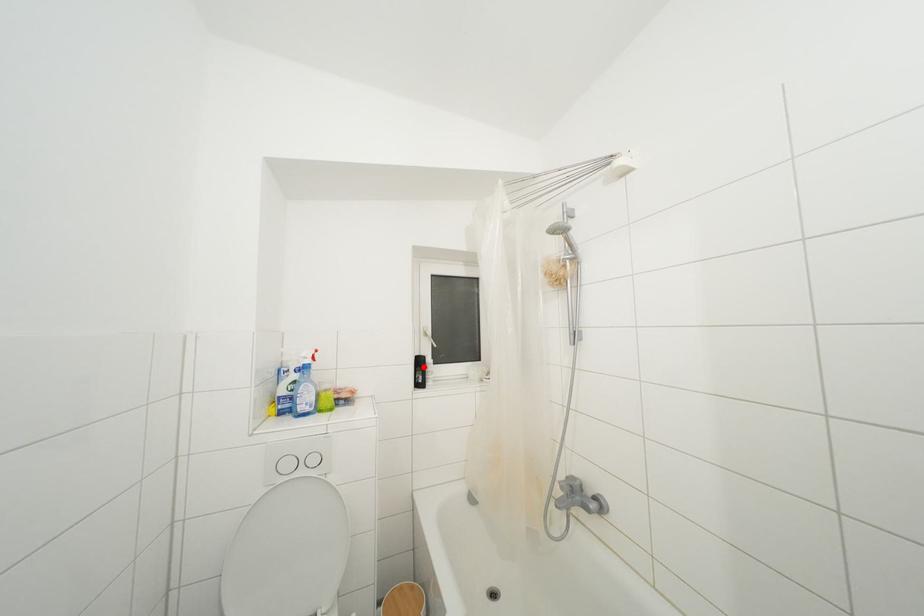
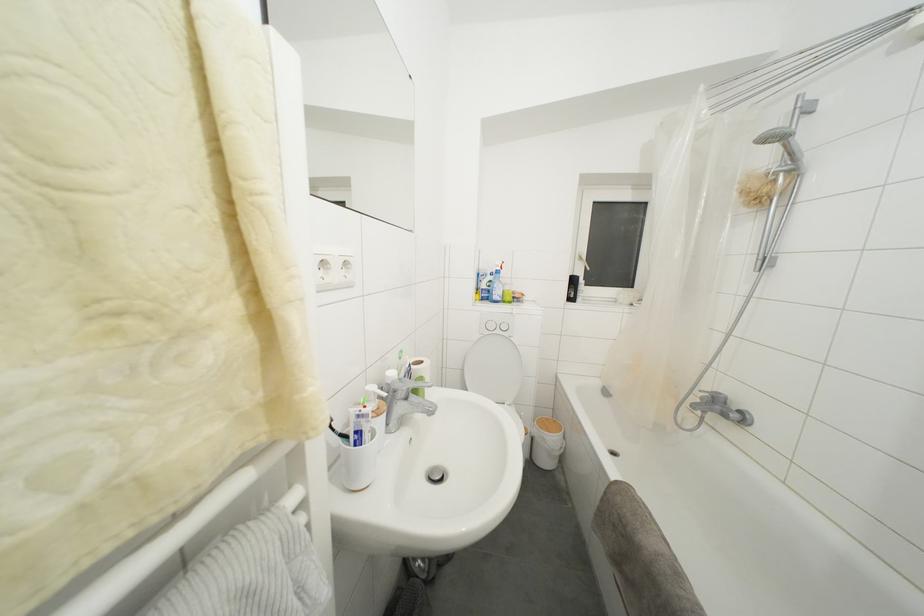
Find the pixel in the second image that matches the highlighted location in the first image.

(578, 286)